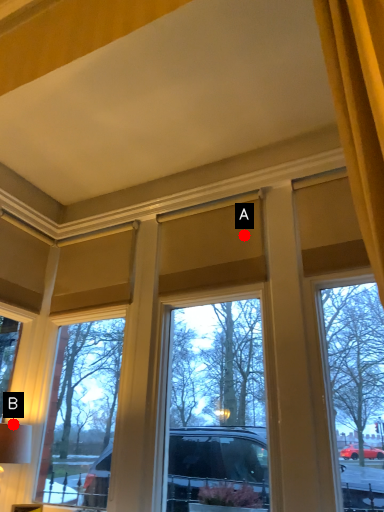
Question: Two points are circled on the image, labeled by A and B beside each circle. Which point is closer to the camera?

Choices:
 (A) A is closer
 (B) B is closer

Answer: (B)